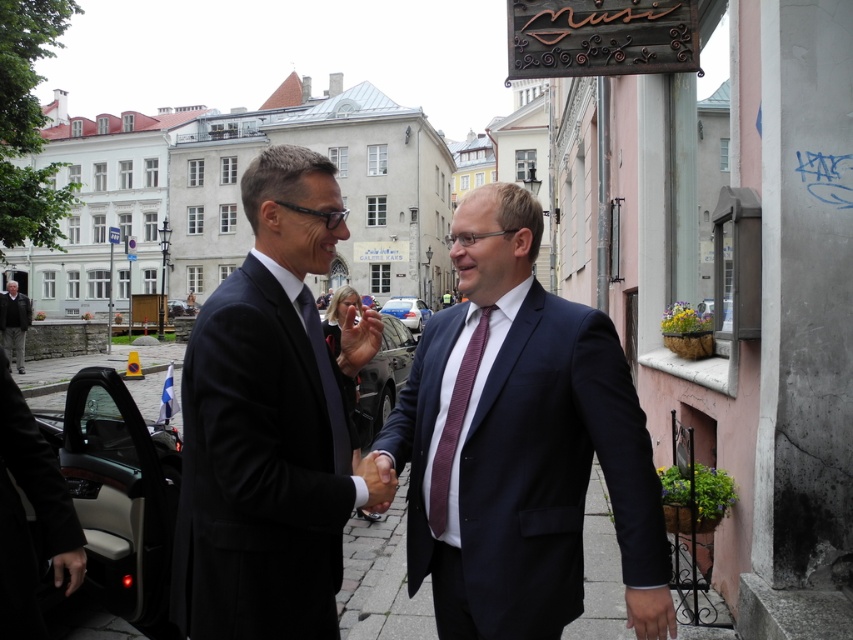
Question: Is navy blue suit at center to the right of dark gray suit at lower left from the viewer's perspective?

Choices:
 (A) yes
 (B) no

Answer: (A)

Question: Is navy blue suit at center above dark blue suit at center?

Choices:
 (A) no
 (B) yes

Answer: (A)

Question: Which object appears farthest from the camera in this image?

Choices:
 (A) matte black suit at center
 (B) dark gray leather car at lower left

Answer: (A)

Question: Which object is closer to the camera taking this photo?

Choices:
 (A) metallic blue car at center
 (B) maroon textured tie at center

Answer: (B)

Question: Which of these objects is positioned closest to the matte black suit at center?

Choices:
 (A) dark gray leather car at lower left
 (B) glossy black car at center

Answer: (B)

Question: Is dark gray leather car at lower left closer to the viewer compared to metallic blue car at center?

Choices:
 (A) no
 (B) yes

Answer: (B)